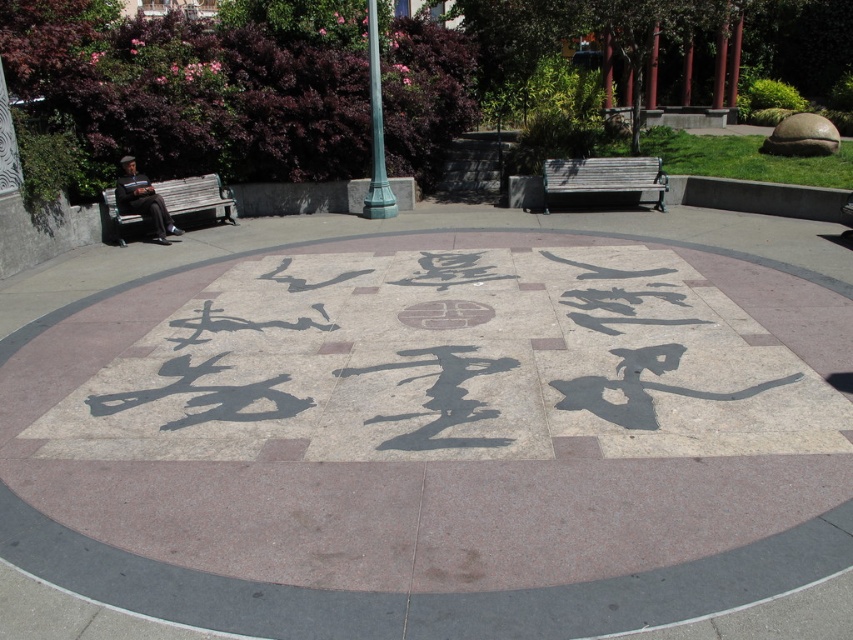
Question: Which object is closer to the camera taking this photo?

Choices:
 (A) wooden park bench at center
 (B) wooden bench at left

Answer: (B)

Question: Can you confirm if wooden bench at left is positioned above black stone circle at center?

Choices:
 (A) no
 (B) yes

Answer: (B)

Question: Is wooden park bench at center to the right of black stone circle at center from the viewer's perspective?

Choices:
 (A) yes
 (B) no

Answer: (A)

Question: Which of the following is the farthest from the observer?

Choices:
 (A) black stone circle at center
 (B) wooden bench at left
 (C) wooden park bench at center

Answer: (C)

Question: Which of the following is the farthest from the observer?

Choices:
 (A) (187, 192)
 (B) (656, 202)

Answer: (B)

Question: Is wooden park bench at center wider than wooden bench at left?

Choices:
 (A) yes
 (B) no

Answer: (A)